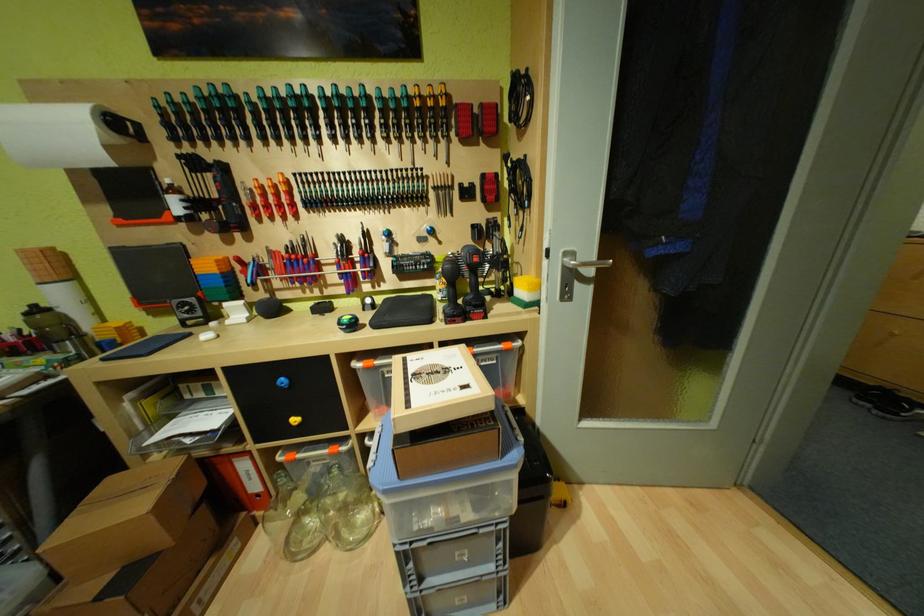
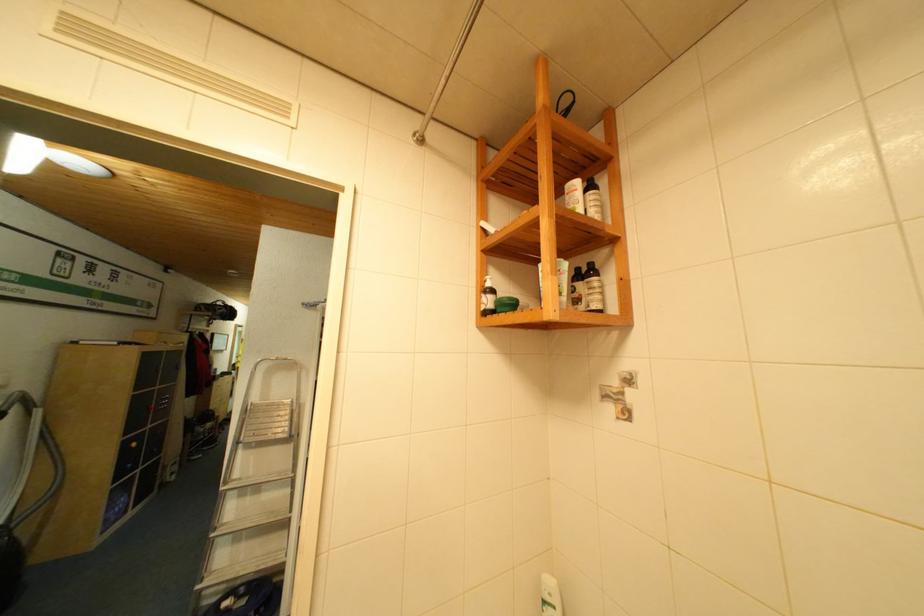
Question: I am providing you with two images of the same scene from different viewpoints. After the viewpoint changes to image2, which objects are now occluded?

Choices:
 (A) white pump bottle
 (B) cordless drill handle
 (C) light blue case
 (D) small cabinet knob

Answer: (B)